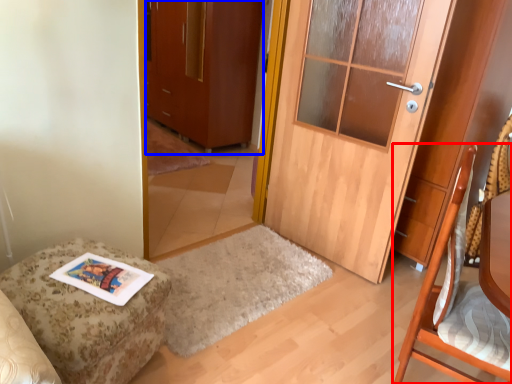
Question: Which object is closer to the camera taking this photo, chair (highlighted by a red box) or cabinetry (highlighted by a blue box)?

Choices:
 (A) chair
 (B) cabinetry

Answer: (A)